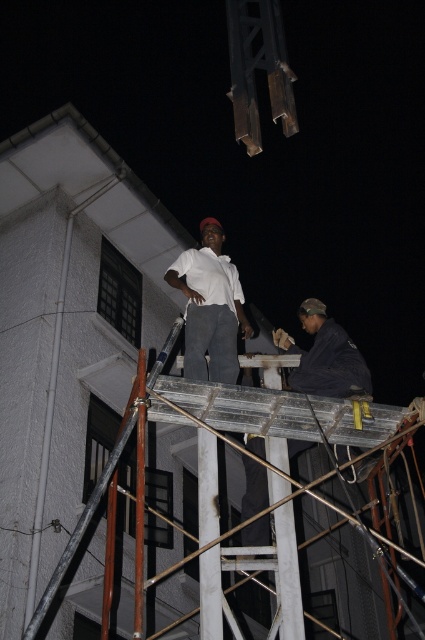
Question: Is rusty metal ladder at upper center smaller than white matte shirt at center?

Choices:
 (A) no
 (B) yes

Answer: (A)

Question: Is rusty metal ladder at upper center positioned at the back of dark gray fabric at center?

Choices:
 (A) yes
 (B) no

Answer: (B)

Question: In this image, where is rusty metal ladder at upper center located relative to dark gray fabric at center?

Choices:
 (A) below
 (B) above

Answer: (A)

Question: Among these points, which one is farthest from the camera?

Choices:
 (A) (354, 371)
 (B) (209, 561)
 (C) (231, 333)

Answer: (C)

Question: Which object appears farthest from the camera in this image?

Choices:
 (A) rusty metal ladder at upper center
 (B) dark gray fabric at center

Answer: (B)

Question: Among these points, which one is farthest from the camera?

Choices:
 (A) (231, 356)
 (B) (323, 442)
 (C) (280, 344)

Answer: (C)